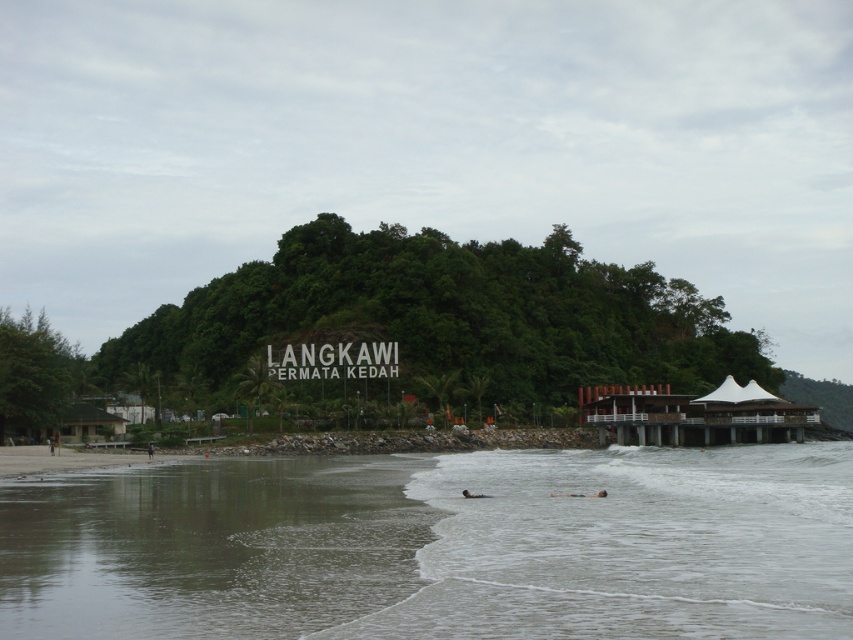
Which is above, clear water at center or clear water at lower left?

Positioned higher is clear water at lower left.

Based on the photo, measure the distance between clear water at center and camera.

They are 10.36 meters apart.

Find the location of `clear water at center`. clear water at center is located at coordinates (631, 545).